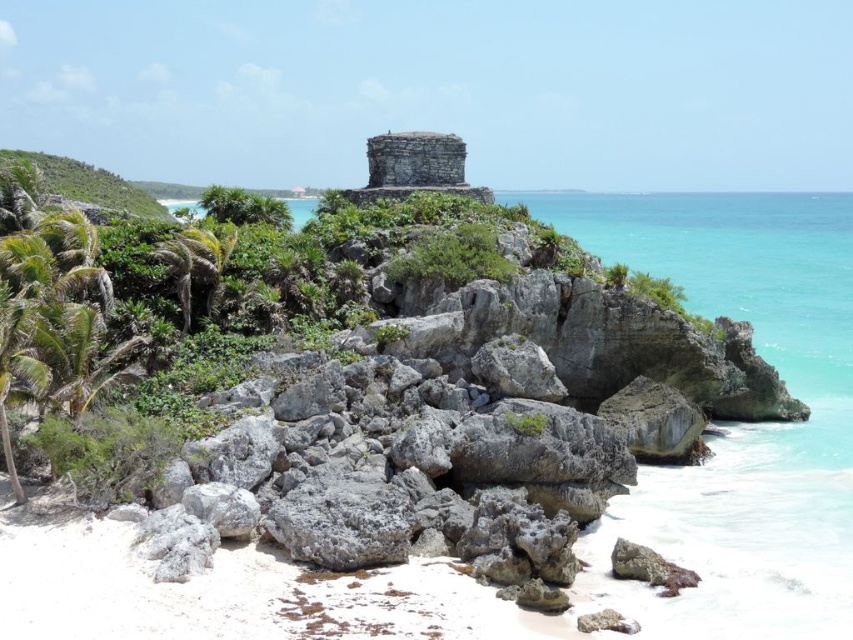
Who is more forward, (780,205) or (169,241)?

Point (169,241)

Locate an element on the screen. This screenshot has width=853, height=640. turquoise water at center is located at coordinates [740, 422].